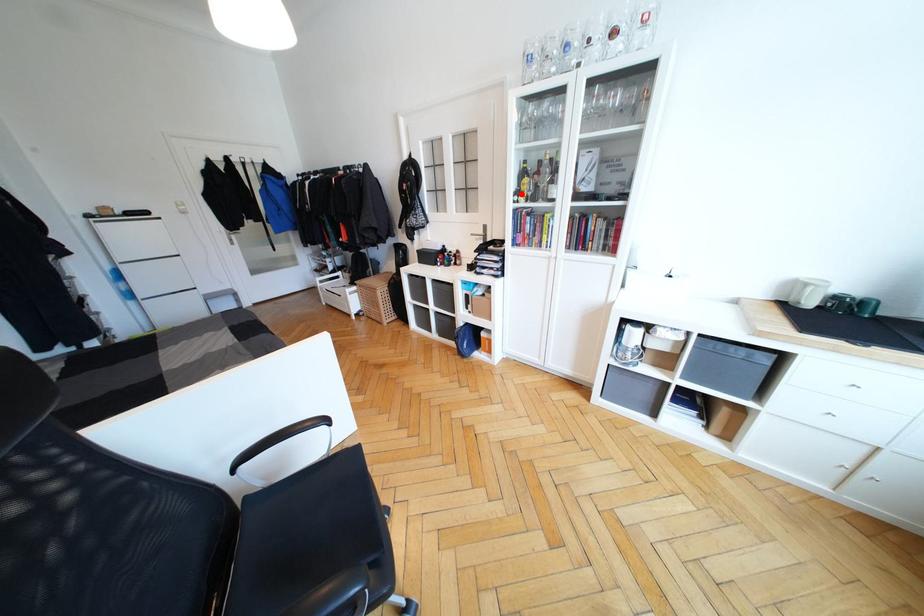
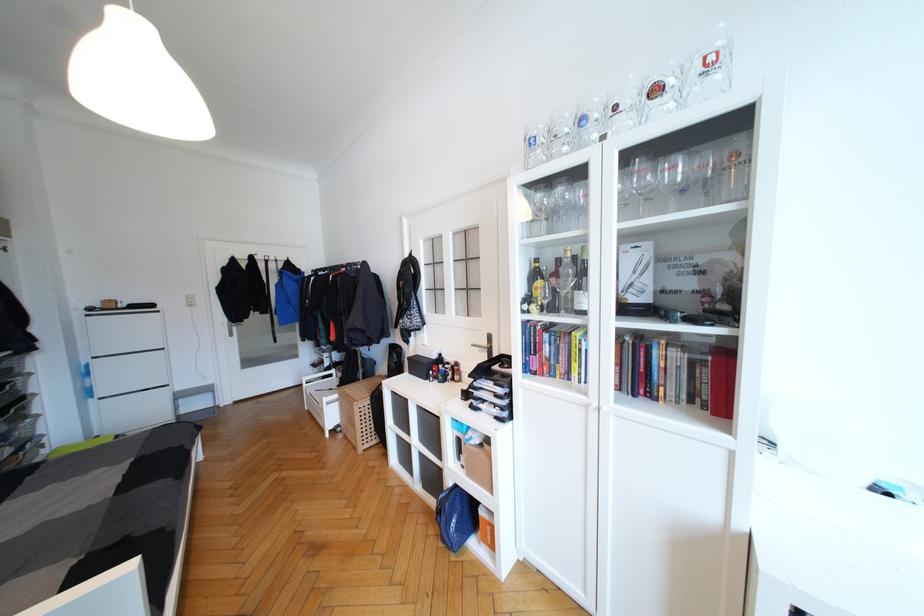
The point at the highlighted location is marked in the first image. Where is the corresponding point in the second image?

(531, 301)